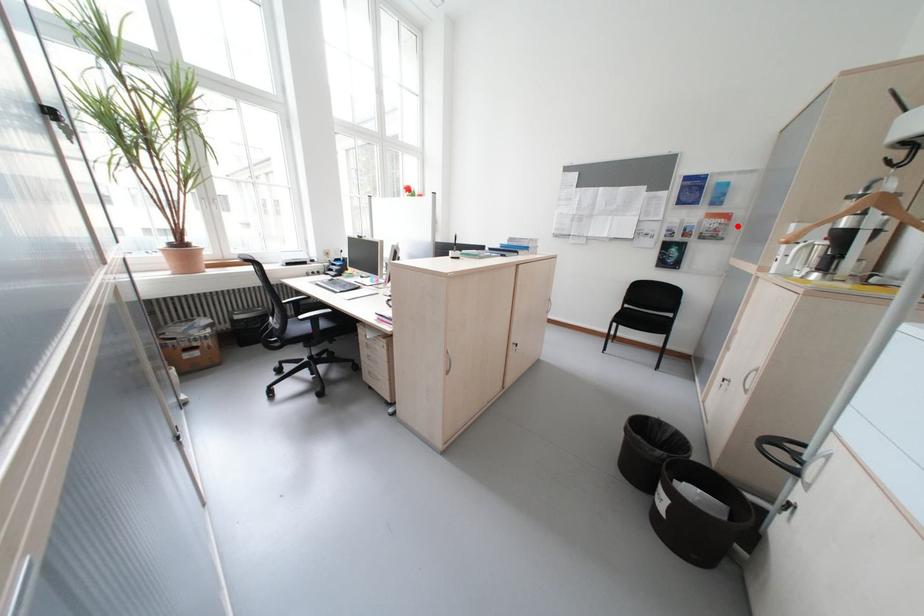
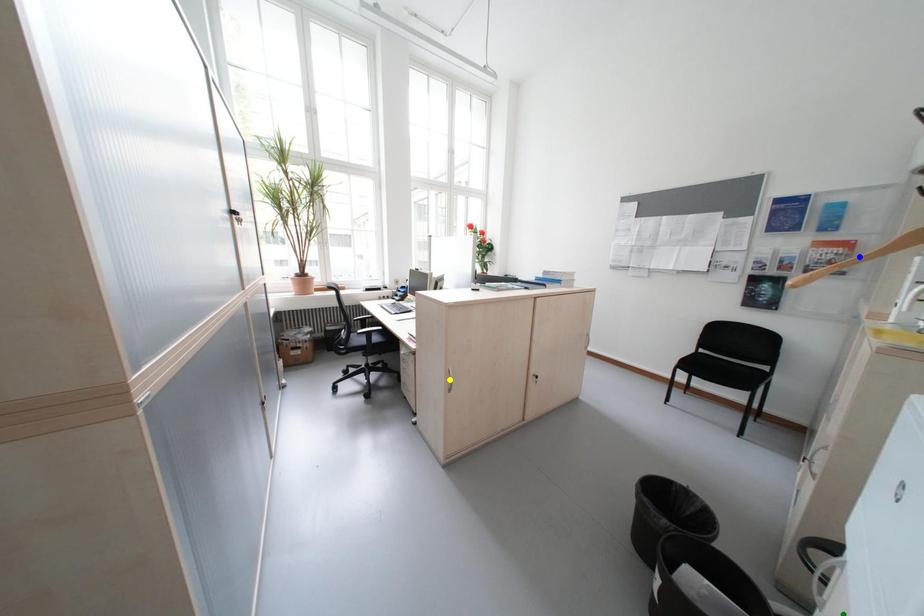
Question: I am providing you with two images of the same scene from different viewpoints. A red point is marked on the first image. You are given multiple points on the second image. Which point in image 2 is actually the same real-world point as the red point in image 1?

Choices:
 (A) yellow point
 (B) blue point
 (C) green point

Answer: (B)